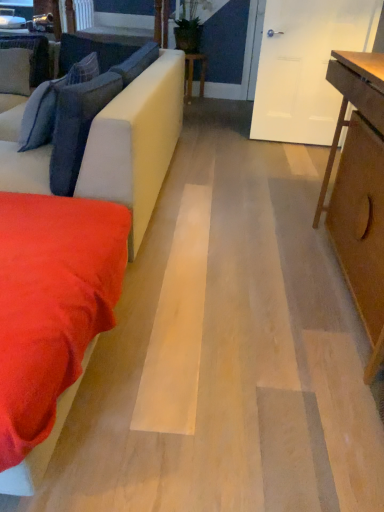
Question: Does suede-like red blanket at lower left have a lesser width compared to velvety blue pillow at left, the first pillow in the front-to-back sequence?

Choices:
 (A) yes
 (B) no

Answer: (B)

Question: Can you confirm if suede-like red blanket at lower left is taller than velvety blue pillow at left, the first pillow in the front-to-back sequence?

Choices:
 (A) no
 (B) yes

Answer: (A)

Question: From the image's perspective, would you say suede-like red blanket at lower left is positioned over velvety blue pillow at left, acting as the 4th pillow starting from the back?

Choices:
 (A) no
 (B) yes

Answer: (A)

Question: Would you say suede-like red blanket at lower left is a long distance from velvety blue pillow at left, acting as the 4th pillow starting from the back?

Choices:
 (A) yes
 (B) no

Answer: (B)

Question: Is suede-like red blanket at lower left positioned behind velvety blue pillow at left, the first pillow in the front-to-back sequence?

Choices:
 (A) yes
 (B) no

Answer: (B)

Question: Is suede-like red blanket at lower left aimed at velvety blue pillow at left, the first pillow in the front-to-back sequence?

Choices:
 (A) no
 (B) yes

Answer: (A)

Question: Can dark blue fabric pillow at left, acting as the 3th pillow starting from the back, be found inside wooden table at center, which appears as the first table when viewed from the back?

Choices:
 (A) yes
 (B) no

Answer: (B)

Question: Is wooden table at center, the second table positioned from the front, closer to the viewer compared to dark blue fabric pillow at left, acting as the 3th pillow starting from the back?

Choices:
 (A) no
 (B) yes

Answer: (A)

Question: Does wooden table at center, arranged as the 2th table when viewed from the right, have a larger size compared to dark blue fabric pillow at left, arranged as the second pillow when viewed from the front?

Choices:
 (A) yes
 (B) no

Answer: (B)

Question: Is wooden table at center, which is counted as the 1th table, starting from the left, behind dark blue fabric pillow at left, acting as the 3th pillow starting from the back?

Choices:
 (A) no
 (B) yes

Answer: (B)

Question: Is wooden table at center, which appears as the first table when viewed from the back, completely or partially outside of dark blue fabric pillow at left, arranged as the second pillow when viewed from the front?

Choices:
 (A) yes
 (B) no

Answer: (A)

Question: From a real-world perspective, does wooden table at center, which ranks as the first table in top-to-bottom order, sit lower than dark blue fabric pillow at left, acting as the 3th pillow starting from the back?

Choices:
 (A) no
 (B) yes

Answer: (B)

Question: From a real-world perspective, is suede-like beige couch at left positioned under suede-like gray pillow at upper left, which is the fourth pillow in front-to-back order, based on gravity?

Choices:
 (A) no
 (B) yes

Answer: (B)